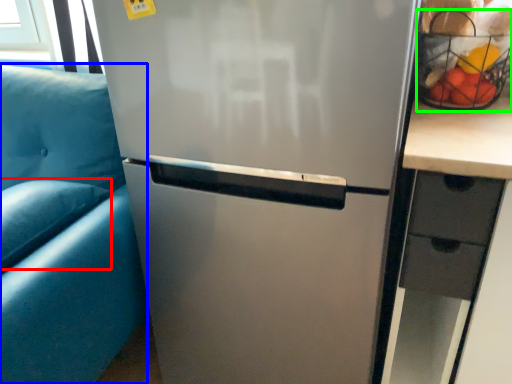
Question: Which is nearer to the pillow (highlighted by a red box)? armchair (highlighted by a blue box) or basket (highlighted by a green box).

Choices:
 (A) armchair
 (B) basket

Answer: (A)